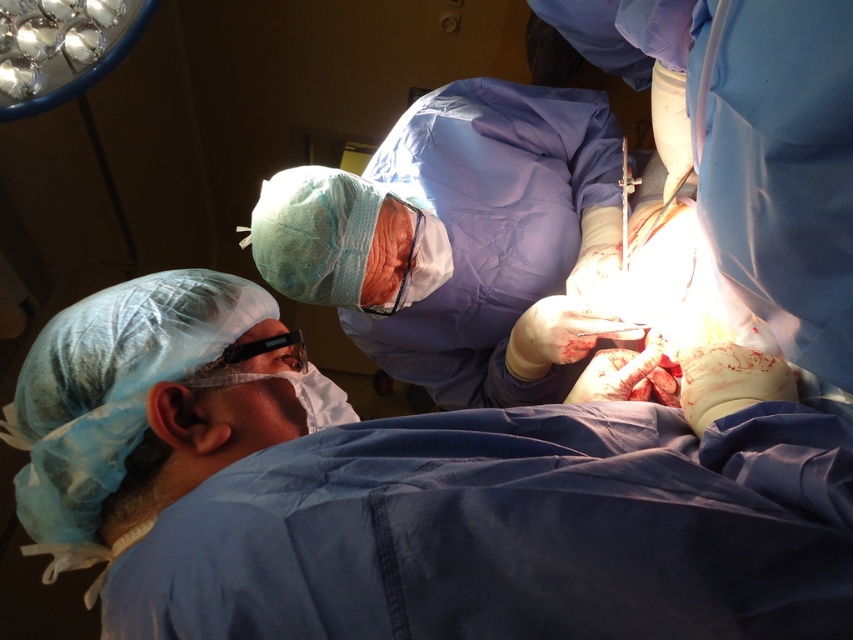
In the scene shown: Which is above, purple smooth gown at center or metallic silver scalpel at upper center?

metallic silver scalpel at upper center is above.

Locate an element on the screen. purple smooth gown at center is located at coordinates (461, 241).

Identify the location of purple smooth gown at center. (461, 241).